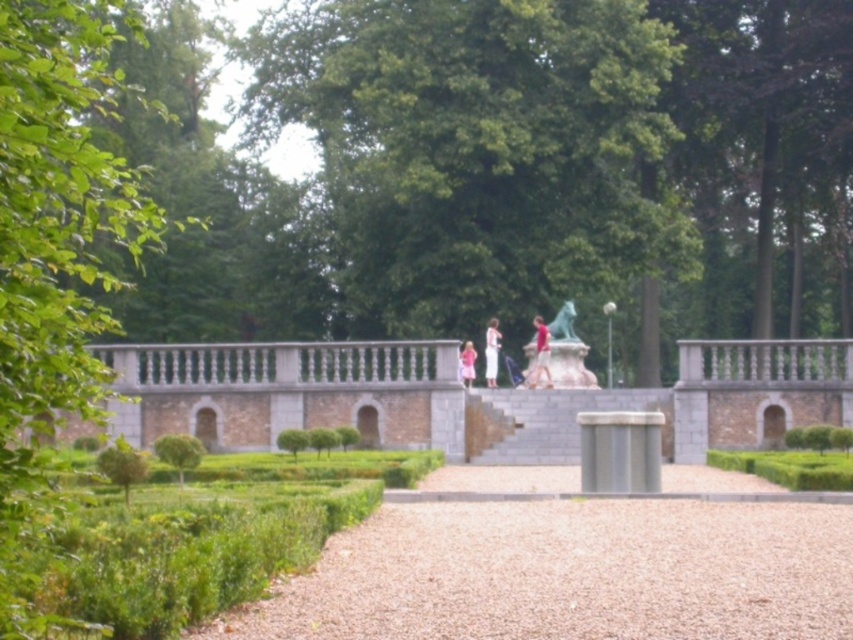
You are a park visitor who wants to take a photo of the green marble statue at center and the green leafy hedge at center. Since you have a camera with a fixed focal length, you need to know which one is bigger to adjust your settings. Which object is larger?

The green marble statue at center is larger than the green leafy hedge at center, so you should adjust your camera settings for the larger object.

You are planning to install a new bench in the park. The bench requires a minimum of 3 meters of space between it and any nearby trees to ensure proper growth. If you place the bench exactly at the location of the green marble statue at center, will it comply with the spacing requirement relative to the green leafy tree at left?

The green leafy tree at left is 36.04 meters away from the green marble statue at center. Since 36.04 meters is greater than the required 3 meters, placing the bench at the green marble statue at center would comply with the spacing requirement.

You are a visitor in the park and want to take a photo of the green marble statue at center and the green leafy hedge at center. Which object should you focus on first if you want to capture both in the same frame without moving the camera?

The green marble statue at center is not as tall as the green leafy hedge at center, so you should focus on the green leafy hedge at center first as it is taller and will occupy more space in the frame.